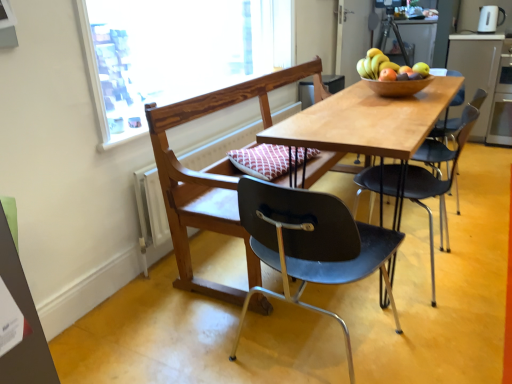
Question: Can you confirm if shiny brown bowl at upper right, which is the first fruit in left-to-right order, is positioned to the left of wooden table at center?

Choices:
 (A) no
 (B) yes

Answer: (B)

Question: From a real-world perspective, is shiny brown bowl at upper right, acting as the 2th fruit starting from the right, on top of wooden table at center?

Choices:
 (A) yes
 (B) no

Answer: (A)

Question: Is shiny brown bowl at upper right, acting as the 2th fruit starting from the right, touching wooden table at center?

Choices:
 (A) yes
 (B) no

Answer: (B)

Question: Is shiny brown bowl at upper right, which is the first fruit in left-to-right order, oriented towards wooden table at center?

Choices:
 (A) no
 (B) yes

Answer: (A)

Question: Is shiny brown bowl at upper right, acting as the 2th fruit starting from the right, outside of wooden table at center?

Choices:
 (A) no
 (B) yes

Answer: (B)

Question: Is wooden table at center located within shiny brown bowl at upper right, which is the first fruit in left-to-right order?

Choices:
 (A) no
 (B) yes

Answer: (A)

Question: Could wooden chair at center, positioned as the second chair in back-to-front order, be considered to be inside wooden table at center?

Choices:
 (A) no
 (B) yes

Answer: (A)

Question: Does wooden table at center have a lesser height compared to wooden chair at center, which appears as the 2th chair when viewed from the front?

Choices:
 (A) yes
 (B) no

Answer: (A)

Question: Can you confirm if wooden table at center is bigger than wooden chair at center, positioned as the second chair in back-to-front order?

Choices:
 (A) yes
 (B) no

Answer: (B)

Question: From a real-world perspective, is wooden table at center physically above wooden chair at center, which appears as the 2th chair when viewed from the front?

Choices:
 (A) yes
 (B) no

Answer: (B)

Question: From the image's perspective, is wooden table at center beneath wooden chair at center, which appears as the 2th chair when viewed from the front?

Choices:
 (A) yes
 (B) no

Answer: (A)

Question: Is wooden table at center not within wooden chair at center, positioned as the second chair in back-to-front order?

Choices:
 (A) no
 (B) yes

Answer: (B)

Question: Would you consider matte black chair at center, which is the 3th chair from front to back, to be distant from green cardboard bulletin board at lower left?

Choices:
 (A) yes
 (B) no

Answer: (A)